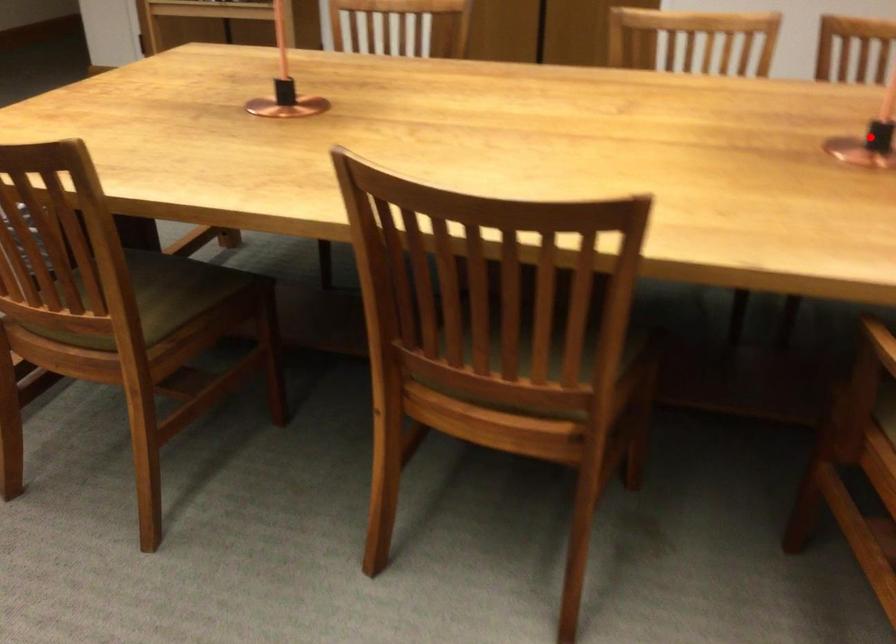
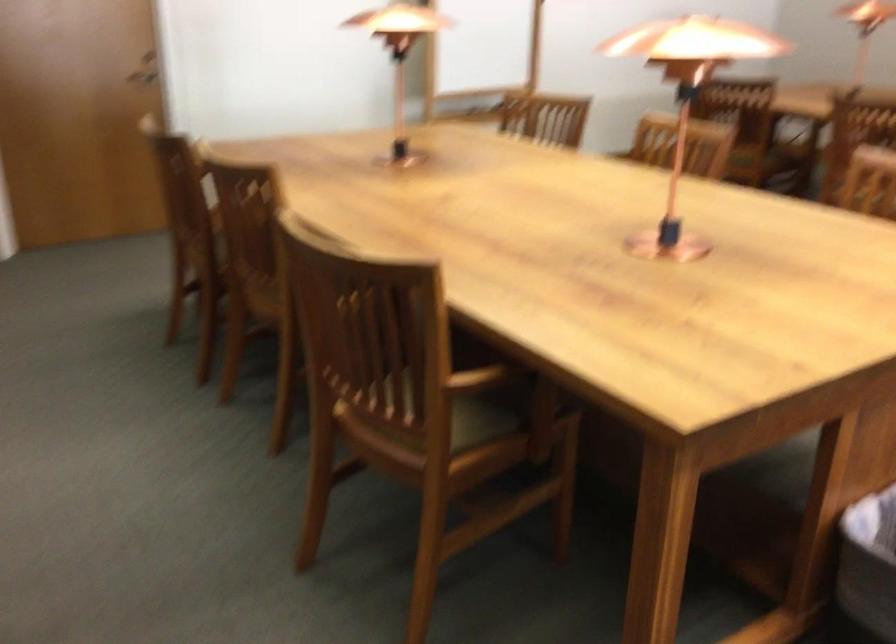
Question: I am providing you with two images of the same scene from different viewpoints. A red point is marked on the first image. Can you still see the location of the red point in image 2?

Choices:
 (A) Yes
 (B) No

Answer: (B)